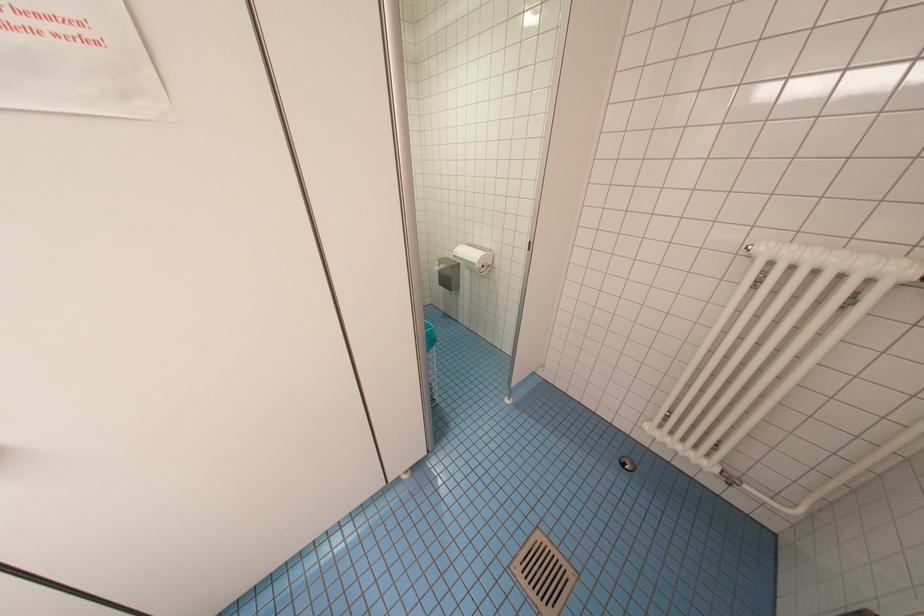
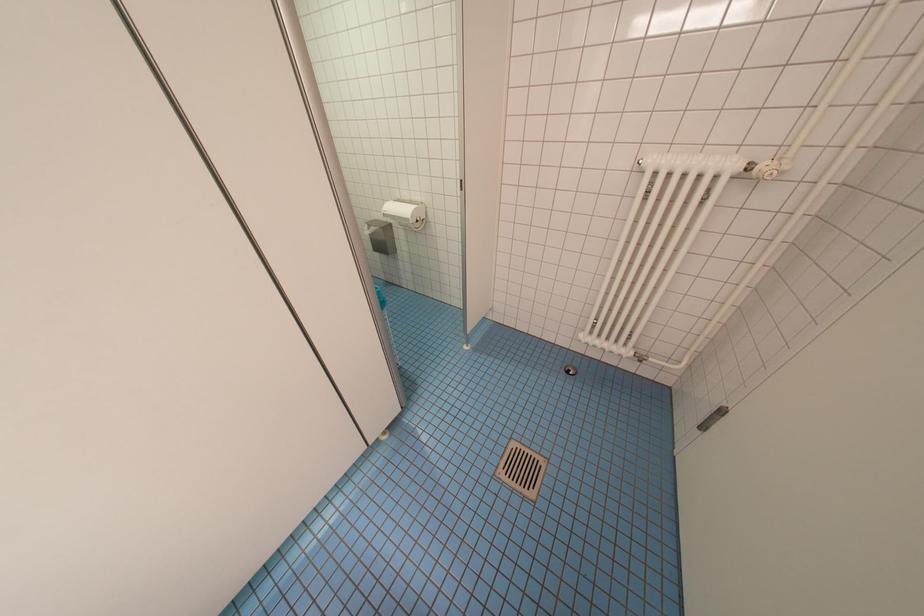
Question: The camera is either moving clockwise (left) or counter-clockwise (right) around the object. The first image is from the beginning of the video and the second image is from the end. Is the camera moving left or right when shooting the video?

Choices:
 (A) Left
 (B) Right

Answer: (A)